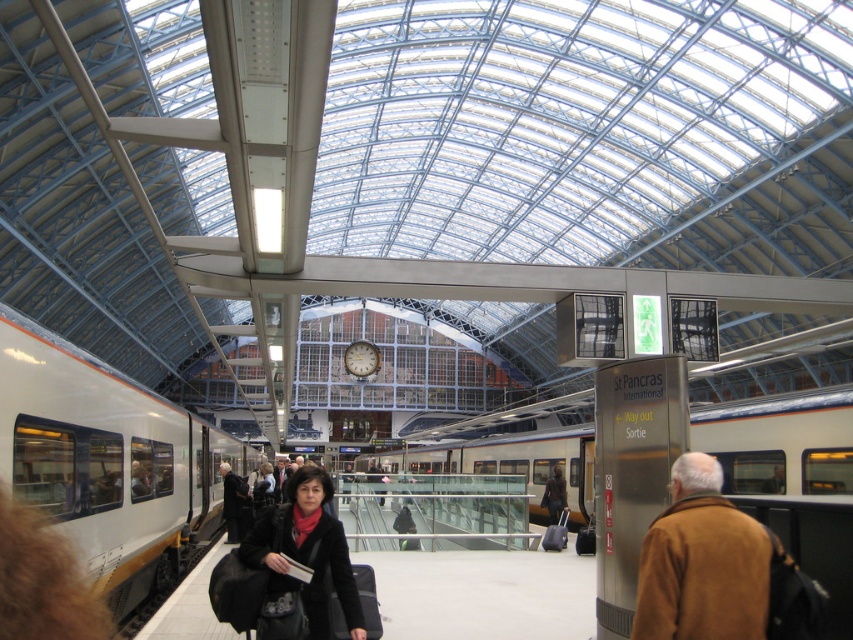
Between white glossy train at left and dark brown leather jacket at center, which one has more height?

white glossy train at left

Which is more to the right, white glossy train at left or dark brown leather jacket at center?

dark brown leather jacket at center

Does point (42, 352) come closer to viewer compared to point (556, 500)?

Yes, it is.

What are the coordinates of `white glossy train at left` in the screenshot? It's located at (108, 461).

Can you confirm if brown leather jacket at lower right is positioned to the right of dark brown leather jacket at center?

In fact, brown leather jacket at lower right is to the left of dark brown leather jacket at center.

Does point (660, 598) lie behind point (550, 474)?

That is False.

Is point (734, 522) positioned in front of point (561, 508)?

Yes.

Where is `brown leather jacket at lower right`? brown leather jacket at lower right is located at coordinates (701, 563).

Which is above, white glossy train at left or brown leather jacket at lower right?

brown leather jacket at lower right is higher up.

Is point (74, 352) positioned after point (699, 579)?

Yes.

Identify the location of white glossy train at left. (108, 461).